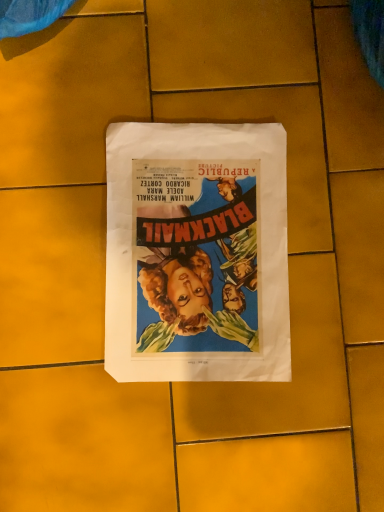
Image resolution: width=384 pixels, height=512 pixels. Identify the location of free point above colorful paper poster at center (from a real-world perspective). (196, 254).